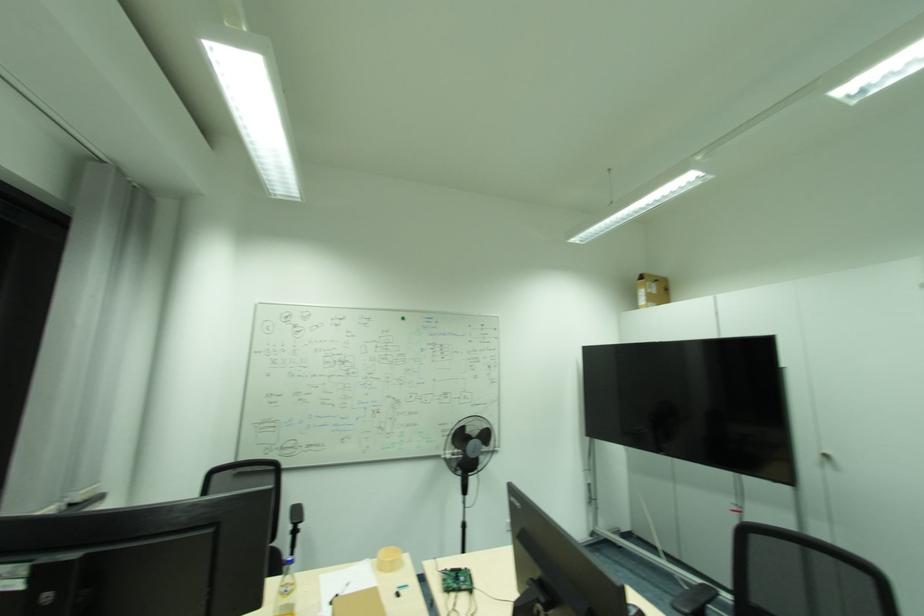
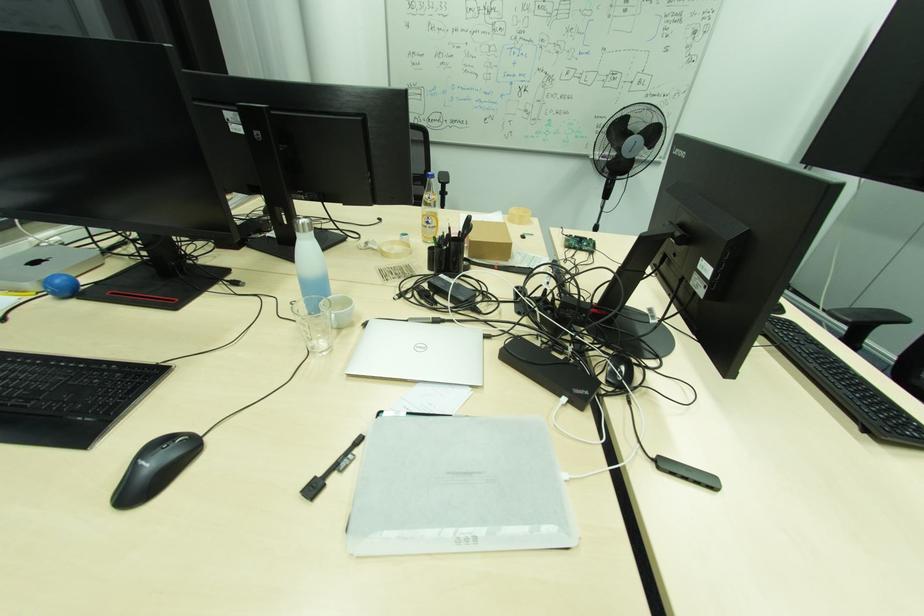
The first image is from the beginning of the video and the second image is from the end. How did the camera likely rotate when shooting the video?

The camera rotated toward left-down.